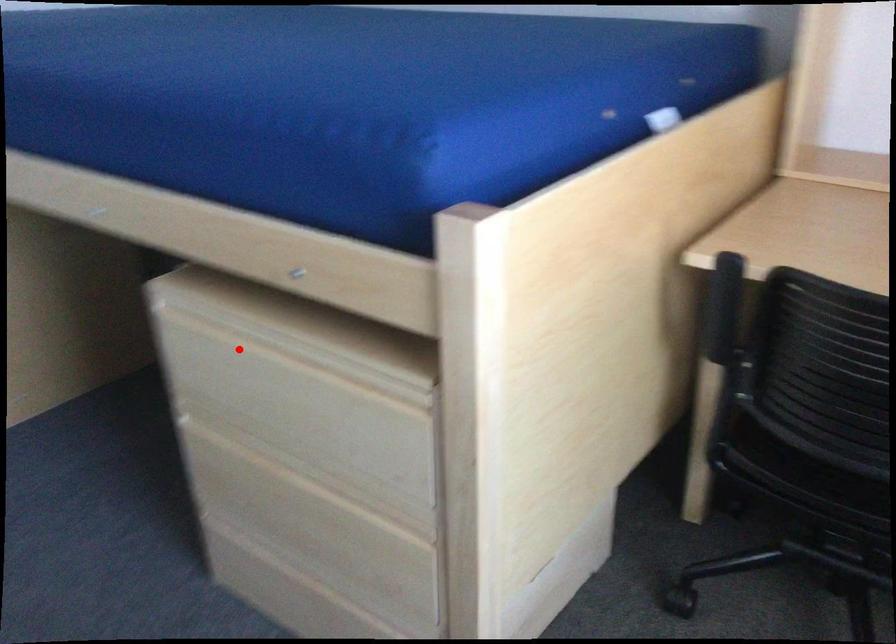
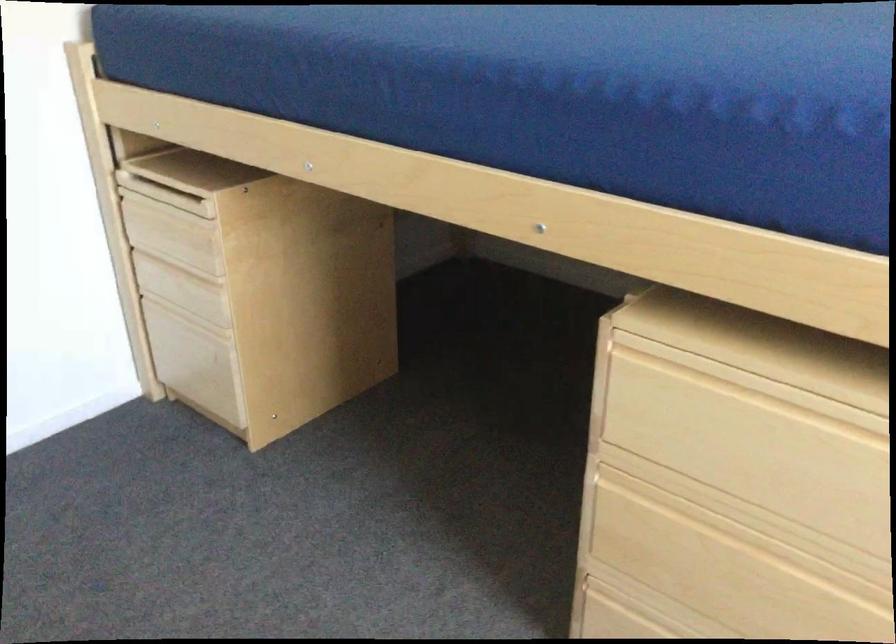
Question: I am providing you with two images of the same scene from different viewpoints. Given a red point in image1, look at the same physical point in image2. Is it:

Choices:
 (A) Closer to the viewpoint
 (B) Farther from the viewpoint

Answer: (A)